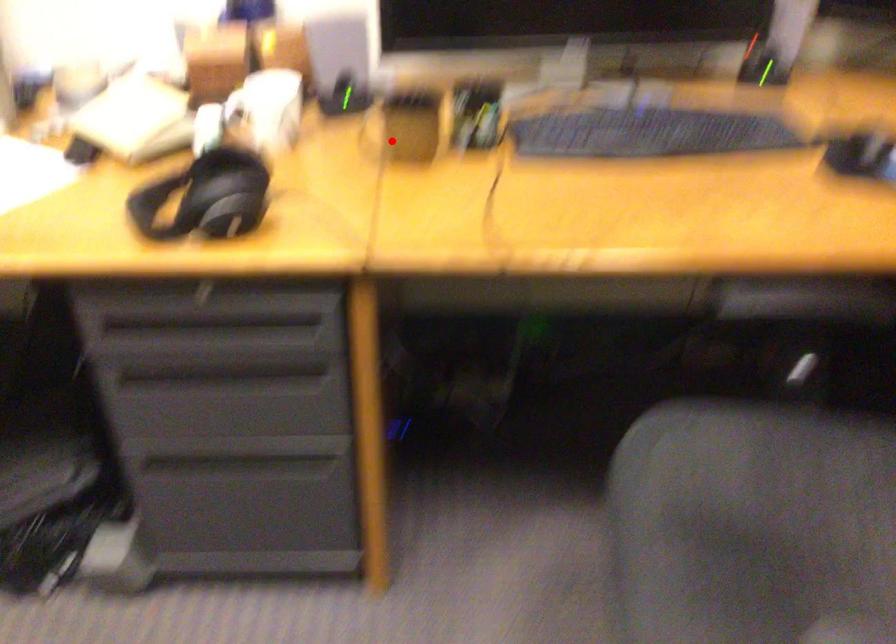
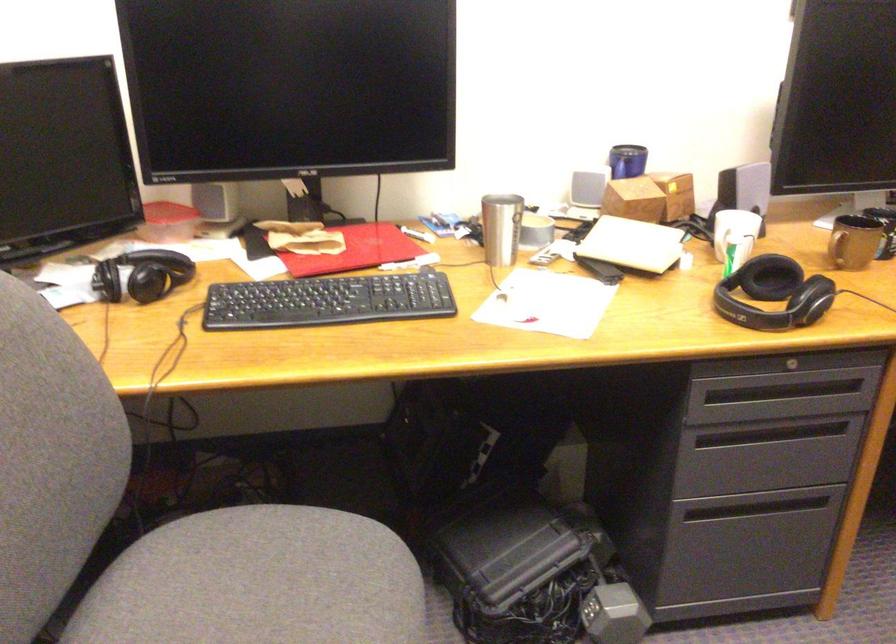
Question: I am providing you with two images of the same scene from different viewpoints. A red point is marked on the first image. At the location where the point appears in image 1, is it still visible in image 2?

Choices:
 (A) Yes
 (B) No

Answer: (A)